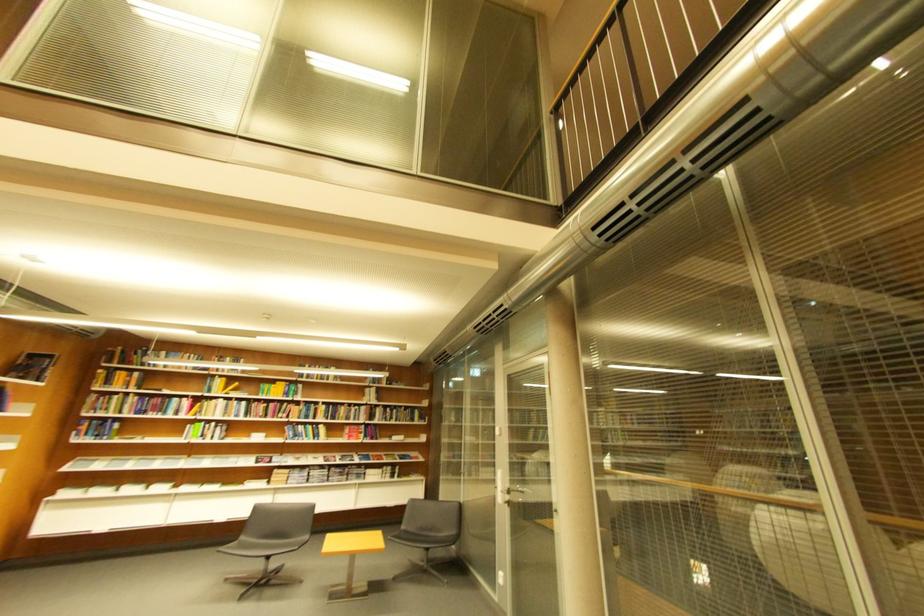
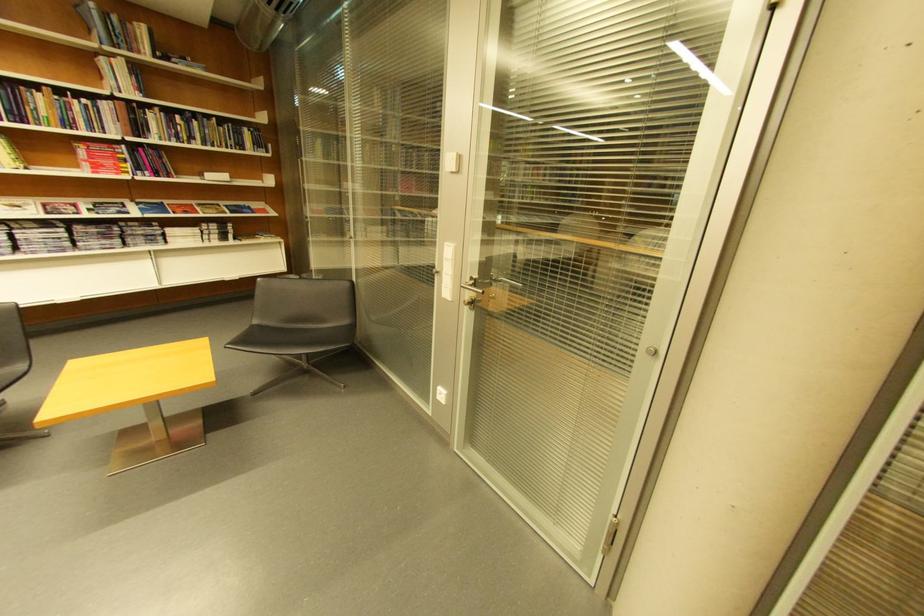
The point at (406, 413) is marked in the first image. Where is the corresponding point in the second image?

(205, 124)